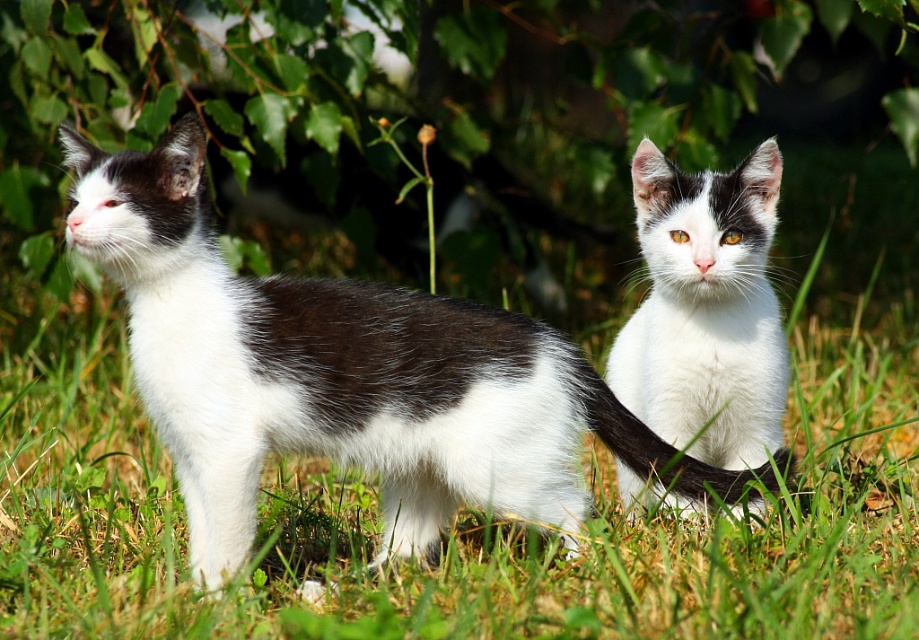
Can you confirm if black and white fur cat at left is positioned above black fur tail at center?

Yes, black and white fur cat at left is above black fur tail at center.

Does point (501, 337) come closer to viewer compared to point (619, 449)?

Yes, it is.

The image size is (919, 640). Identify the location of black and white fur cat at left. (345, 378).

Who is positioned more to the left, white soft fur cat at center or black fur tail at center?

black fur tail at center

Can you confirm if white soft fur cat at center is smaller than black fur tail at center?

Actually, white soft fur cat at center might be larger than black fur tail at center.

Is point (747, 356) closer to camera compared to point (650, 440)?

That is False.

Where is `white soft fur cat at center`? This screenshot has width=919, height=640. white soft fur cat at center is located at coordinates (705, 310).

Who is shorter, black and white fur cat at left or white soft fur cat at center?

With less height is white soft fur cat at center.

Consider the image. Who is taller, black and white fur cat at left or white soft fur cat at center?

Standing taller between the two is black and white fur cat at left.

Between point (224, 333) and point (627, 372), which one is positioned behind?

The point (627, 372) is behind.

At what (x,y) coordinates should I click in order to perform the action: click on black and white fur cat at left. Please return your answer as a coordinate pair (x, y). The width and height of the screenshot is (919, 640). Looking at the image, I should click on (345, 378).